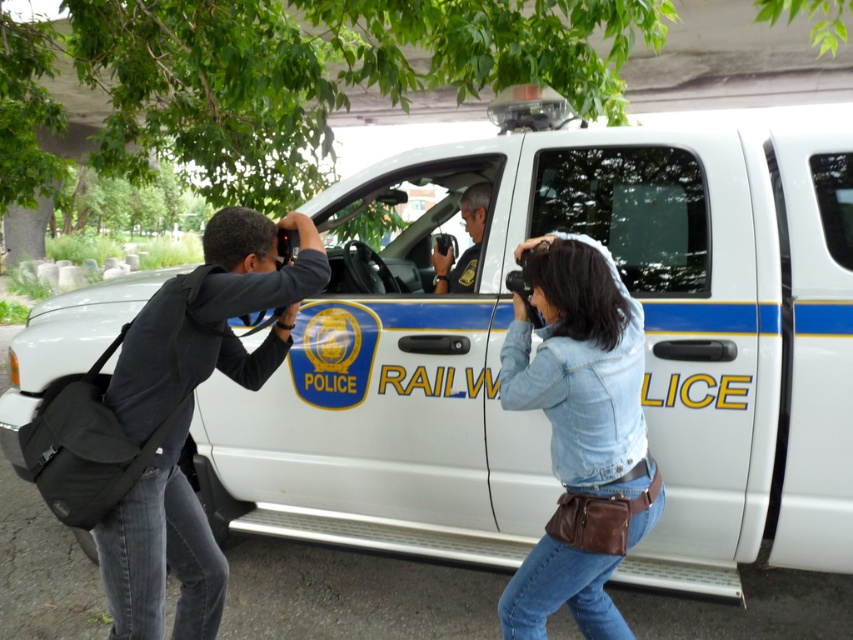
Question: Which object is the closest to the matte black uniform at center?

Choices:
 (A) dark gray hoodie at left
 (B) denim jacket at lower right

Answer: (B)

Question: Can you confirm if denim jacket at lower right is bigger than matte black uniform at center?

Choices:
 (A) yes
 (B) no

Answer: (A)

Question: Is denim jacket at lower right positioned behind dark gray hoodie at left?

Choices:
 (A) yes
 (B) no

Answer: (A)

Question: Is denim jacket at lower right smaller than matte black uniform at center?

Choices:
 (A) yes
 (B) no

Answer: (B)

Question: Estimate the real-world distances between objects in this image. Which object is farther from the dark gray hoodie at left?

Choices:
 (A) denim jacket at lower right
 (B) matte black uniform at center

Answer: (B)

Question: Among these objects, which one is nearest to the camera?

Choices:
 (A) denim jacket at lower right
 (B) matte black uniform at center
 (C) dark gray hoodie at left

Answer: (C)